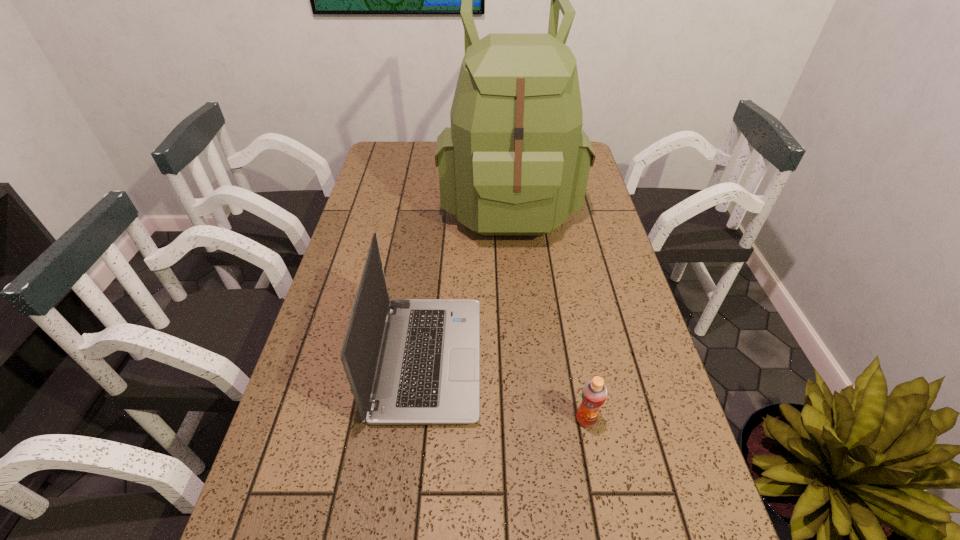
Locate an element on the screen. Image resolution: width=960 pixels, height=540 pixels. vacant space that satisfies the following two spatial constraints: 1. on the screen of the shortest object; 2. on the left side of the laptop computer is located at coordinates pos(422,419).

Where is `vacant area that satisfies the following two spatial constraints: 1. on the front pocket of the orange juice; 2. on the left side of the farthest object`? vacant area that satisfies the following two spatial constraints: 1. on the front pocket of the orange juice; 2. on the left side of the farthest object is located at coordinates (527, 419).

Locate an element on the screen. This screenshot has height=540, width=960. blank space that satisfies the following two spatial constraints: 1. on the back side of the orange juice; 2. on the screen of the laptop computer is located at coordinates (575, 359).